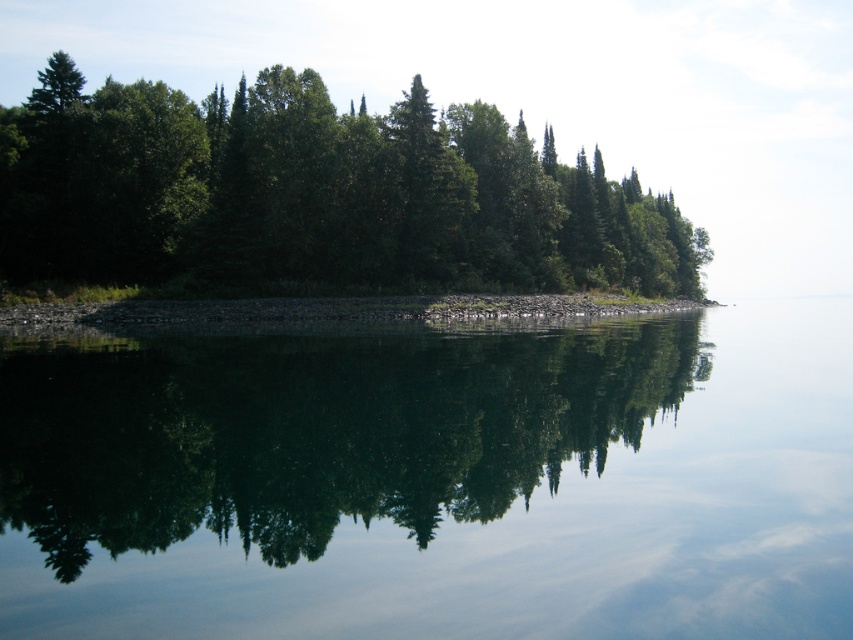
Question: Which is nearer to the gray gravel shoreline at center?

Choices:
 (A) transparent water at center
 (B) green leafy trees at center

Answer: (B)

Question: Does green leafy trees at center appear under gray gravel shoreline at center?

Choices:
 (A) yes
 (B) no

Answer: (B)

Question: Among these objects, which one is nearest to the camera?

Choices:
 (A) transparent water at center
 (B) gray gravel shoreline at center

Answer: (A)

Question: Is transparent water at center smaller than green leafy trees at center?

Choices:
 (A) yes
 (B) no

Answer: (A)

Question: Does transparent water at center appear under gray gravel shoreline at center?

Choices:
 (A) yes
 (B) no

Answer: (A)

Question: Which point is farther from the camera taking this photo?

Choices:
 (A) (379, 308)
 (B) (131, 438)
 (C) (114, 97)

Answer: (C)